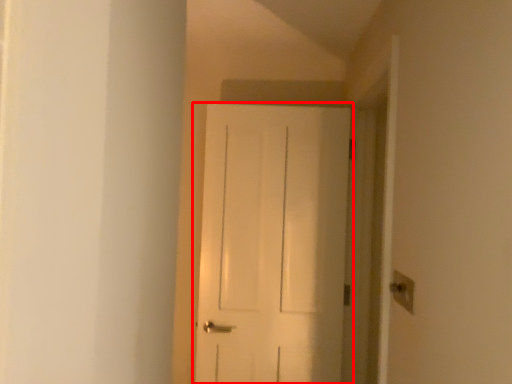
Question: Where is door (annotated by the red box) located in relation to light switch in the image?

Choices:
 (A) right
 (B) left

Answer: (B)